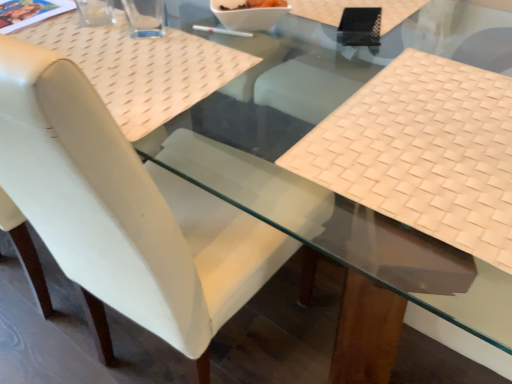
The width and height of the screenshot is (512, 384). In order to click on free space on the front side of white plastic chopstick at center in this screenshot , I will do `click(197, 67)`.